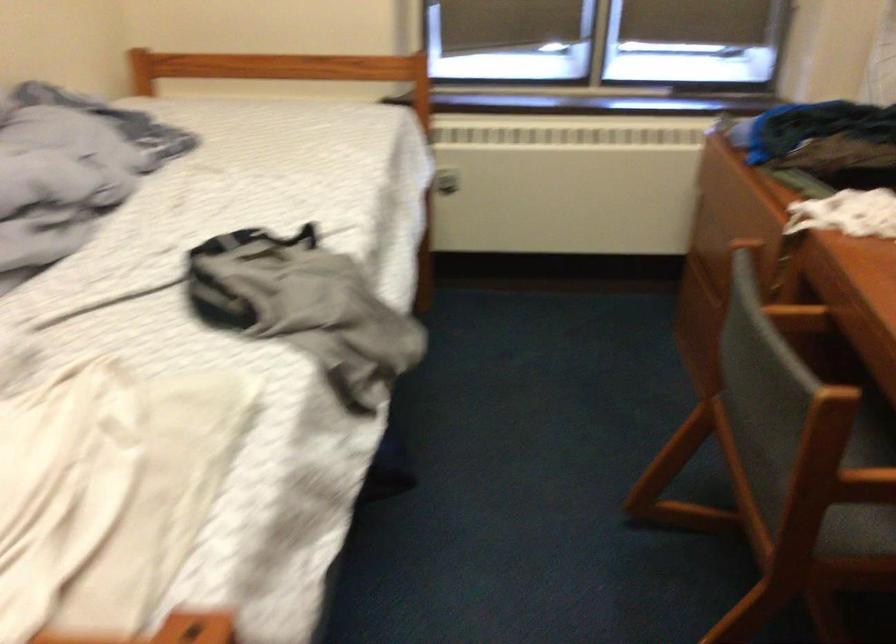
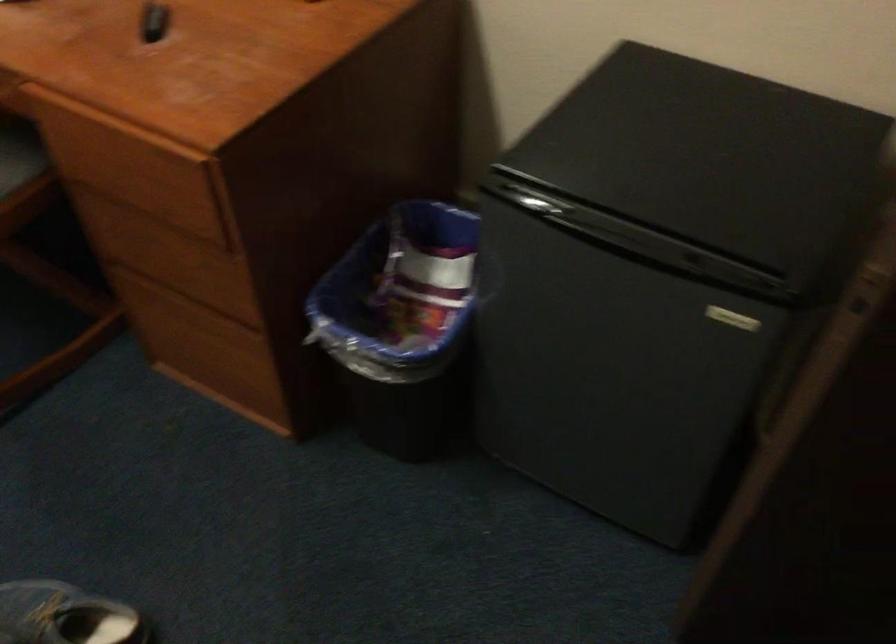
How did the camera likely rotate?

The camera's rotation is toward right-down.